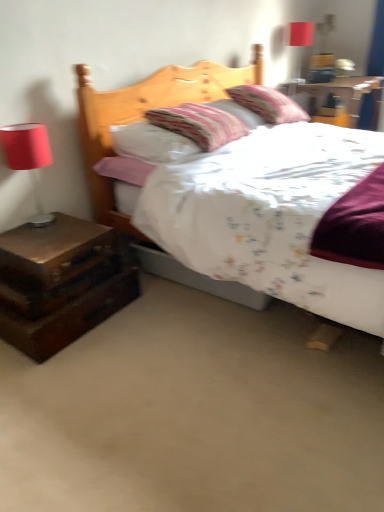
Locate an element on the screen. This screenshot has width=384, height=512. free point above brown wooden nightstand at left, which is the 3th nightstand from back to front (from a real-world perspective) is located at coordinates (36, 239).